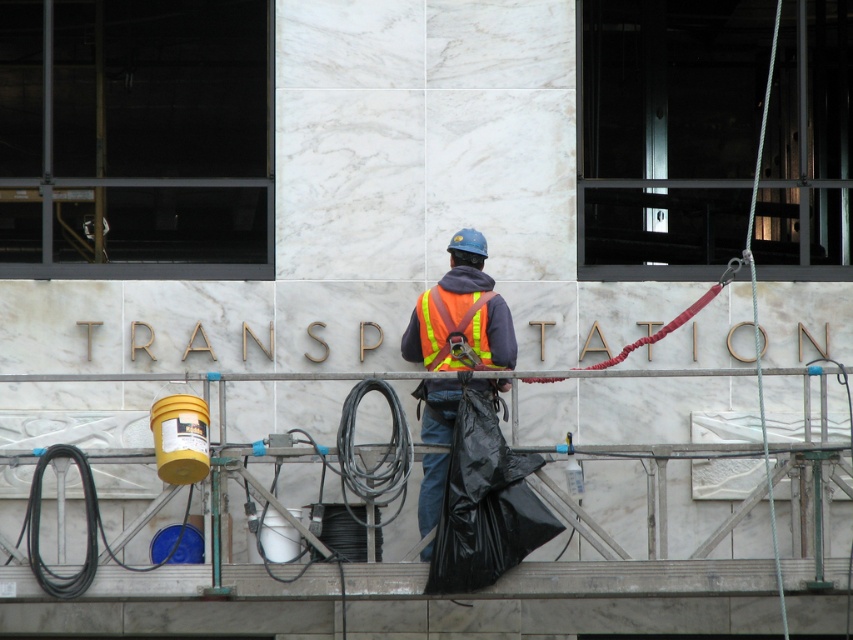
You are a safety inspector reviewing the image of the construction site. You notice a worker at point [461,312]. What color is the safety vest they are wearing?

The reflective orange safety vest at center is located at point [461,312], so the worker there is wearing an orange safety vest.